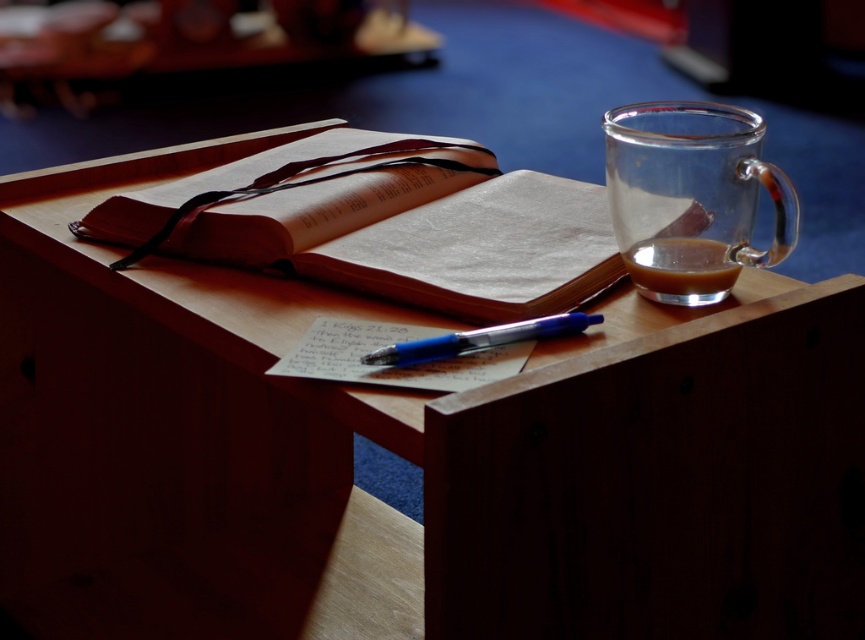
You are a person with a 12 inch ruler. You want to measure the distance between the transparent glass mug at right and the camera. Can you do it with your ruler?

The distance between the transparent glass mug at right and the camera is 17.72 inches. Since your ruler is only 12 inches long, it is not long enough to measure the entire distance. You would need a longer ruler or a different measuring tool to accurately measure the distance between the transparent glass mug at right and the camera.

You are a person with a height of 5 feet 8 inches. You are standing in front of the wooden surface shown in the image. There is a point at coordinates point (x=793, y=208). Can you reach this point with your hand?

The distance of point (x=793, y=208) from viewer is 17.97 inches. Since 17.97 inches is approximately 1.5 feet, and the person is 5 feet 8 inches tall, they can easily reach the point with their hand as it is within comfortable reach.

You are a photographer trying to capture a closeup of the point at coordinates (341, 237) in the scene. Given that the point is 22.64 inches from the camera, will you need to adjust your camera focus to ensure clarity?

The point at coordinates (341, 237) is 22.64 inches from the camera, so you should adjust the camera focus to that distance to ensure clarity.